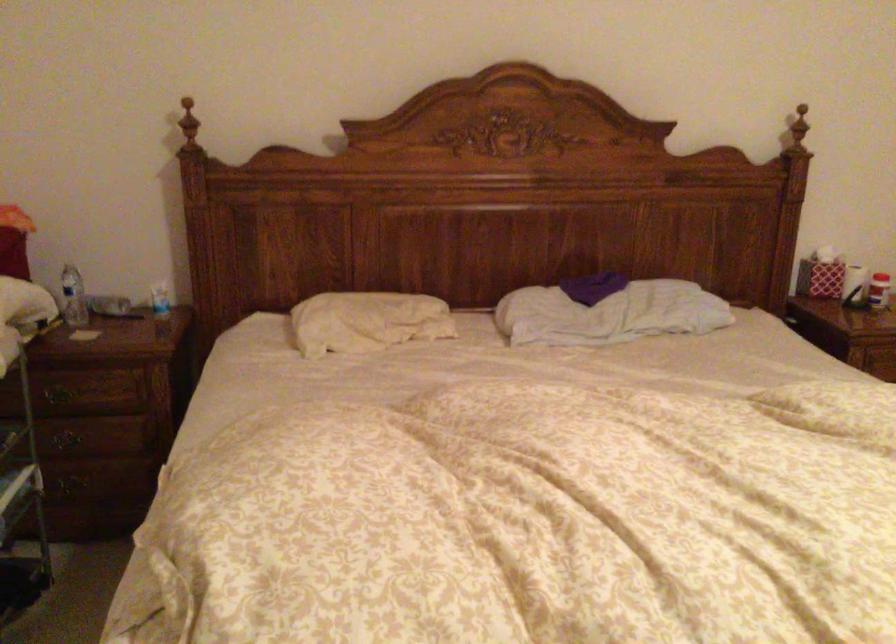
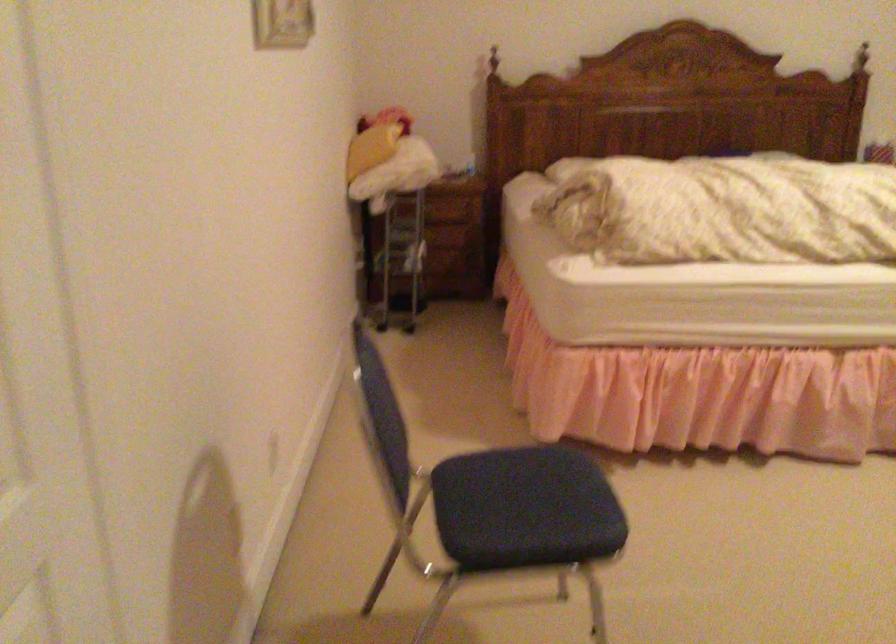
Question: In a continuous first-person perspective shot, in which direction is the camera moving?

Choices:
 (A) Left
 (B) Right
 (C) Forward
 (D) Backward

Answer: (D)